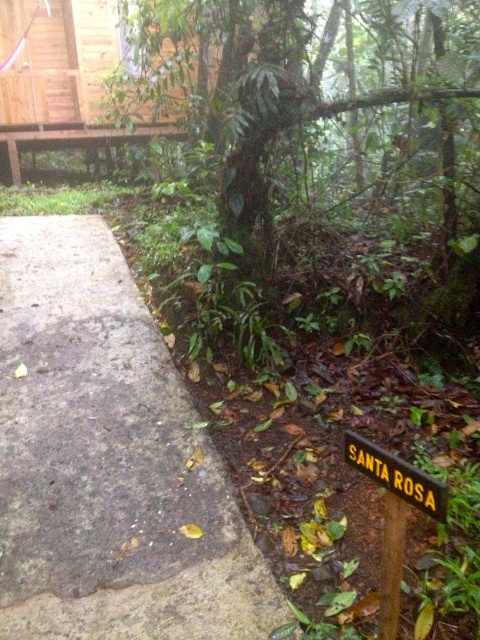
Question: Is green leafy tree at center wider than yellowmaterial/texturesign at lower right?

Choices:
 (A) yes
 (B) no

Answer: (A)

Question: Which point is closer to the camera?

Choices:
 (A) (201, 125)
 (B) (99, 488)

Answer: (B)

Question: Does gray concrete path at center lie in front of green leafy tree at center?

Choices:
 (A) yes
 (B) no

Answer: (A)

Question: Estimate the real-world distances between objects in this image. Which object is farther from the yellowmaterial/texturesign at lower right?

Choices:
 (A) green leafy tree at center
 (B) gray concrete path at center

Answer: (A)

Question: Is gray concrete path at center bigger than yellowmaterial/texturesign at lower right?

Choices:
 (A) no
 (B) yes

Answer: (B)

Question: Which object is the closest to the gray concrete path at center?

Choices:
 (A) green leafy tree at center
 (B) yellowmaterial/texturesign at lower right

Answer: (B)